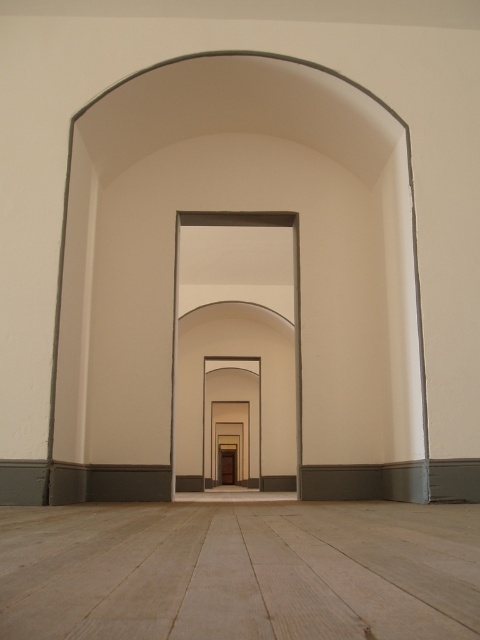
Question: Among these points, which one is farthest from the camera?

Choices:
 (A) (251, 227)
 (B) (476, 588)

Answer: (A)

Question: Can you confirm if light wood floor at center is bigger than smooth white archway at center?

Choices:
 (A) no
 (B) yes

Answer: (A)

Question: Among these points, which one is nearest to the camera?

Choices:
 (A) (262, 545)
 (B) (274, 353)

Answer: (A)

Question: Can you confirm if light wood floor at center is wider than smooth white archway at center?

Choices:
 (A) no
 (B) yes

Answer: (A)

Question: Considering the relative positions of light wood floor at center and smooth white archway at center in the image provided, where is light wood floor at center located with respect to smooth white archway at center?

Choices:
 (A) below
 (B) above

Answer: (B)

Question: Which point is closer to the camera taking this photo?

Choices:
 (A) (29, 540)
 (B) (238, 253)

Answer: (A)